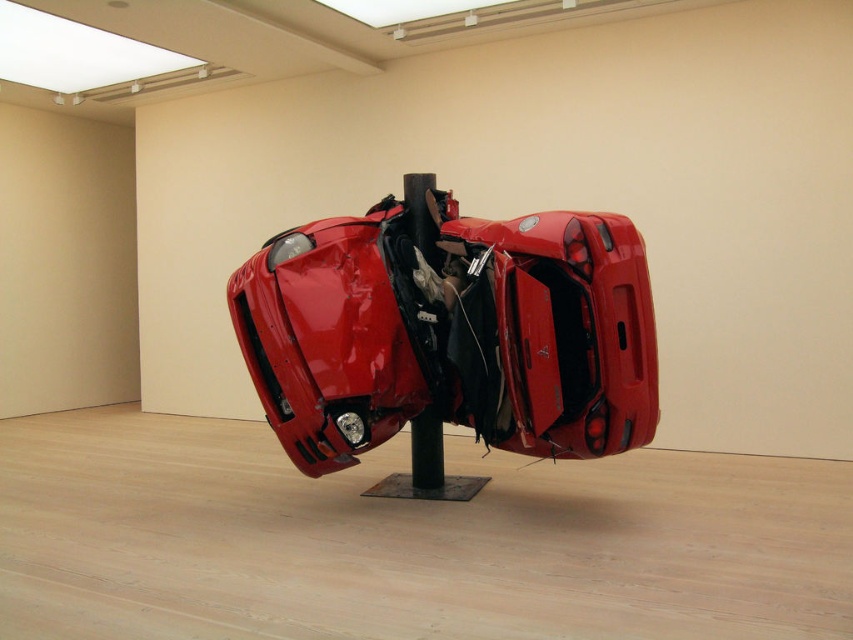
Question: Can you confirm if glossy red car at center is positioned to the right of black matte pole at center?

Choices:
 (A) yes
 (B) no

Answer: (A)

Question: Is glossy red car at center to the right of black matte pole at center from the viewer's perspective?

Choices:
 (A) no
 (B) yes

Answer: (B)

Question: Which of the following is the farthest from the observer?

Choices:
 (A) black matte pole at center
 (B) glossy red car at center

Answer: (A)

Question: Among these objects, which one is farthest from the camera?

Choices:
 (A) glossy red car at center
 (B) black matte pole at center

Answer: (B)

Question: Can you confirm if glossy red car at center is bigger than black matte pole at center?

Choices:
 (A) yes
 (B) no

Answer: (A)